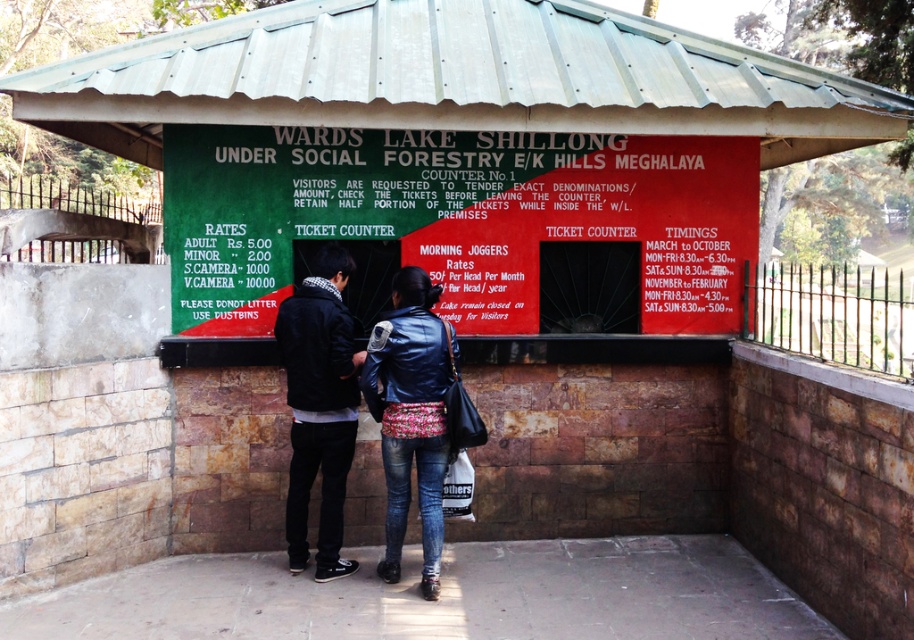
Question: Which point is closer to the camera taking this photo?

Choices:
 (A) (463, 436)
 (B) (236, 314)
 (C) (397, 410)
 (D) (307, 493)

Answer: (A)

Question: Estimate the real-world distances between objects in this image. Which object is farther from the black leather jacket at center?

Choices:
 (A) leather jacket at center
 (B) green painted board at center

Answer: (B)

Question: Does dark blue leather jacket at center lie behind black leather jacket at center?

Choices:
 (A) yes
 (B) no

Answer: (B)

Question: Which point is farther to the camera?

Choices:
 (A) black leather jacket at center
 (B) leather jacket at center

Answer: (A)

Question: Is green painted board at center positioned at the back of black leather jacket at center?

Choices:
 (A) yes
 (B) no

Answer: (A)

Question: Does green painted board at center have a larger size compared to black leather jacket at center?

Choices:
 (A) yes
 (B) no

Answer: (A)